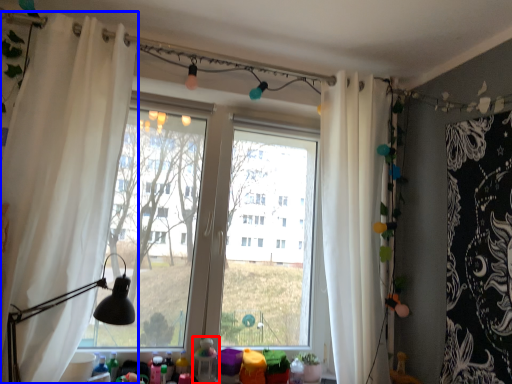
Question: Which point is further to the camera, toy (highlighted by a red box) or curtain (highlighted by a blue box)?

Choices:
 (A) toy
 (B) curtain

Answer: (A)